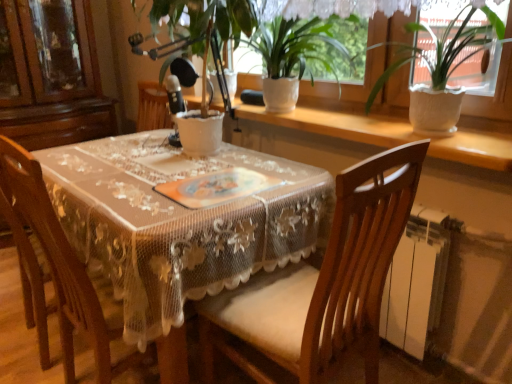
Identify the location of free point below white ceramic pot at upper right, which is the 1th houseplant in right-to-left order (from a real-world perspective). (418, 135).